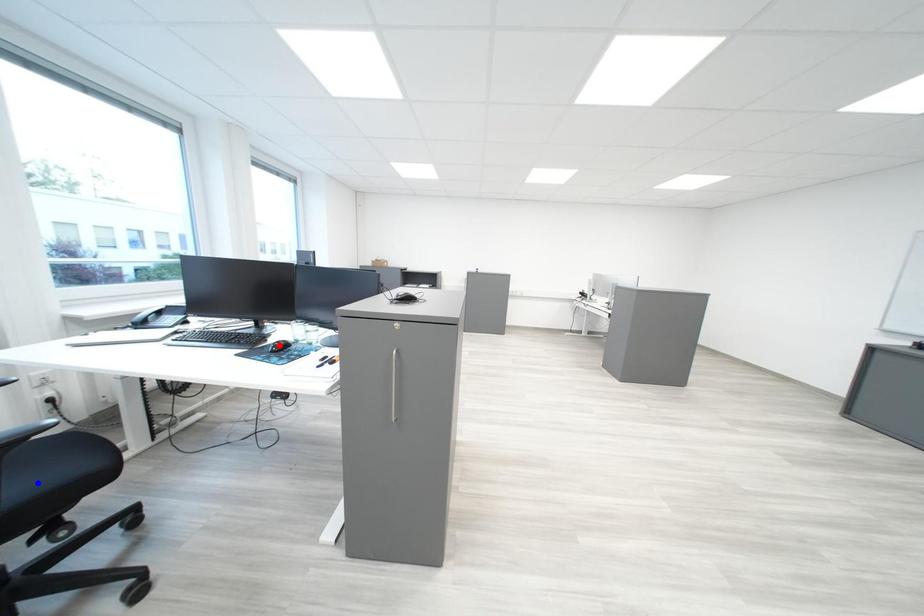
Question: In the image, two points are highlighted. Which point is nearer to the camera? Reply with the corresponding letter.

Choices:
 (A) blue point
 (B) red point

Answer: (A)